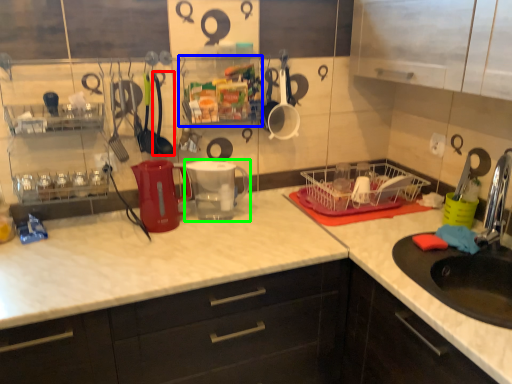
Question: Based on their relative distances, which object is farther from tableware (highlighted by a red box)? Choose from shelf (highlighted by a blue box) and appliance (highlighted by a green box).

Choices:
 (A) shelf
 (B) appliance

Answer: (A)